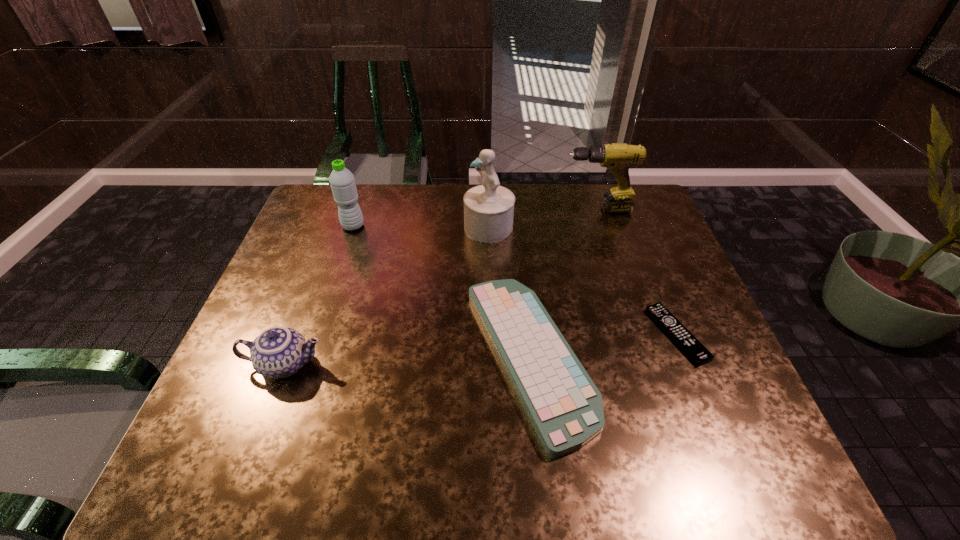
This screenshot has height=540, width=960. I want to click on free region at the far right corner of the desktop, so click(x=636, y=221).

Locate an element on the screen. This screenshot has height=540, width=960. vacant area between the third shortest object and the second shortest object is located at coordinates (407, 361).

Image resolution: width=960 pixels, height=540 pixels. I want to click on free space between the third shortest object and the drill, so click(x=441, y=287).

Identify the location of free spot between the water bottle and the computer keyboard. Image resolution: width=960 pixels, height=540 pixels. (441, 292).

This screenshot has width=960, height=540. Find the location of `empty location between the fifth tallest object and the third shortest object`. empty location between the fifth tallest object and the third shortest object is located at coordinates (407, 361).

The width and height of the screenshot is (960, 540). Identify the location of empty space that is in between the figurine and the water bottle. (420, 227).

Image resolution: width=960 pixels, height=540 pixels. I want to click on free point between the water bottle and the chinaware, so click(320, 295).

You are a GUI agent. You are given a task and a screenshot of the screen. Output one action in this format:
    pyautogui.click(x=<x>, y=<y>)
    Task: Click on the free space between the third shortest object and the water bottle
    This screenshot has width=960, height=540.
    Given the screenshot: What is the action you would take?
    pyautogui.click(x=320, y=295)

Locate which object is the third closest to the water bottle. Please provide its 2D coordinates. Your answer should be formatted as a tuple, i.e. [(x, y)], where the tuple contains the x and y coordinates of a point satisfying the conditions above.

[(278, 352)]

Image resolution: width=960 pixels, height=540 pixels. In order to click on the closest object relative to the water bottle in this screenshot , I will do `click(488, 208)`.